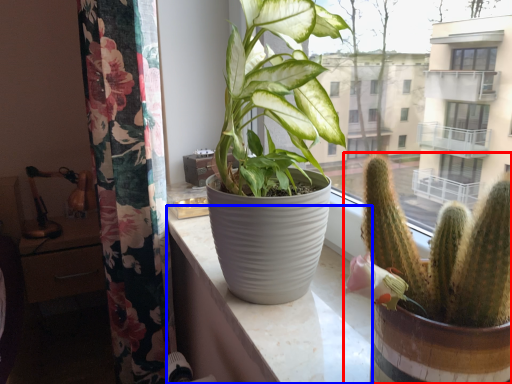
Question: Among these objects, which one is nearest to the camera, houseplant (highlighted by a red box) or counter top (highlighted by a blue box)?

Choices:
 (A) houseplant
 (B) counter top

Answer: (A)